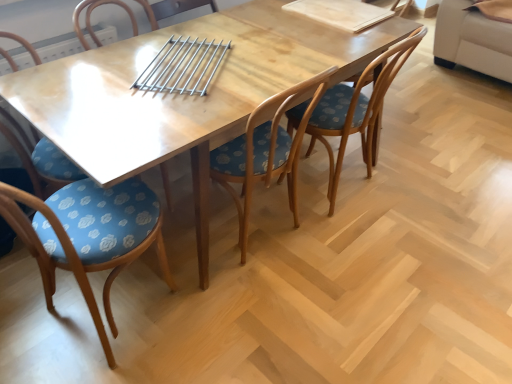
Locate an element on the screen. Image resolution: width=512 pixels, height=384 pixels. free space between blue fabric chair at center, marked as the second chair in a left-to-right arrangement, and wooden chair with floral cushion at center, acting as the third chair starting from the left is located at coordinates (206, 281).